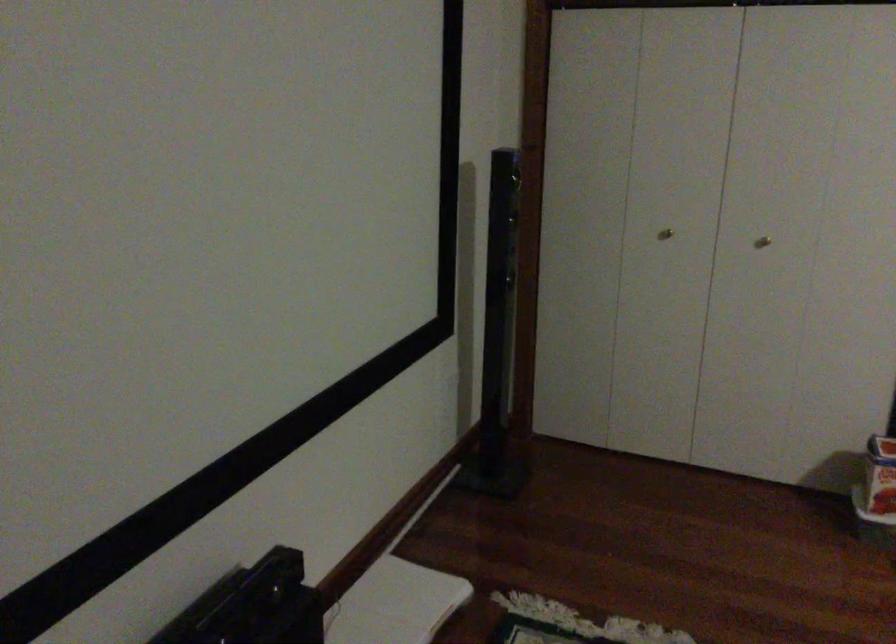
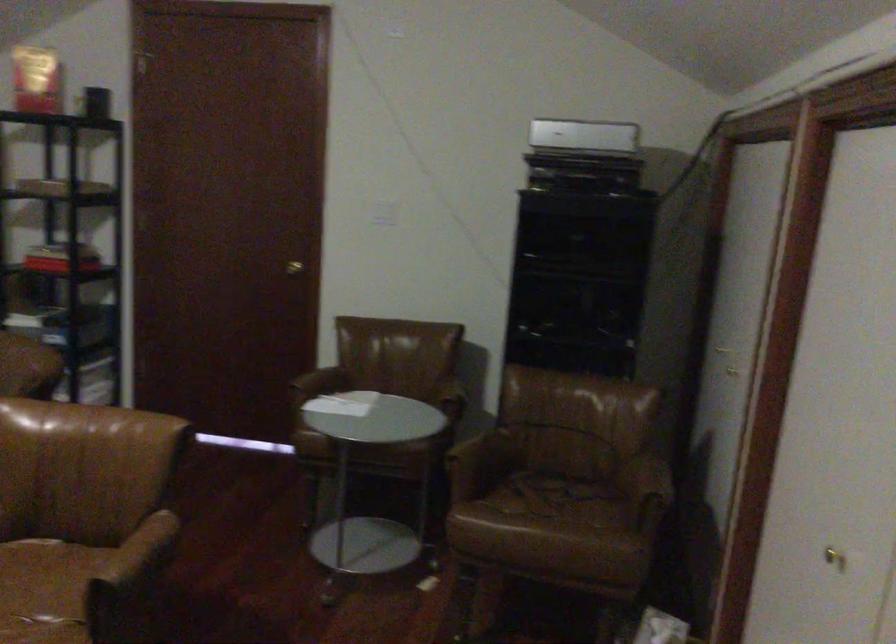
Question: The camera is either moving clockwise (left) or counter-clockwise (right) around the object. The first image is from the beginning of the video and the second image is from the end. Is the camera moving left or right when shooting the video?

Choices:
 (A) Left
 (B) Right

Answer: (A)